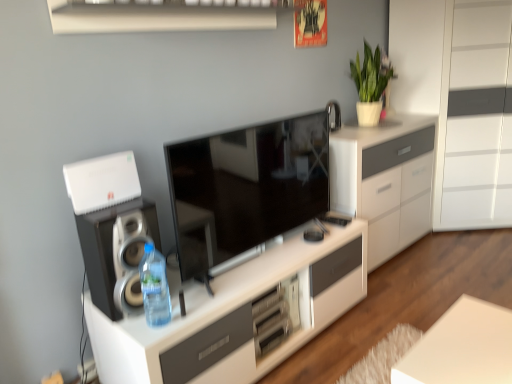
Question: Is white matte table at lower right inside white glossy cabinet at right?

Choices:
 (A) no
 (B) yes

Answer: (A)

Question: Is white matte table at lower right at the back of white glossy cabinet at right?

Choices:
 (A) yes
 (B) no

Answer: (B)

Question: Is white glossy cabinet at right bigger than white matte table at lower right?

Choices:
 (A) yes
 (B) no

Answer: (A)

Question: Can you confirm if white glossy cabinet at right is wider than white matte table at lower right?

Choices:
 (A) yes
 (B) no

Answer: (A)

Question: From a real-world perspective, is white glossy cabinet at right located higher than white matte table at lower right?

Choices:
 (A) no
 (B) yes

Answer: (B)

Question: Looking at the image, does white glossy cabinet at center, which appears as the first cabinetry when ordered from the bottom, seem bigger or smaller compared to white glossy cabinet at center, positioned as the 1th cabinetry in top-to-bottom order?

Choices:
 (A) small
 (B) big

Answer: (A)

Question: In the image, is white glossy cabinet at center, which appears as the first cabinetry when ordered from the bottom, on the left side or the right side of white glossy cabinet at center, placed as the second cabinetry when sorted from bottom to top?

Choices:
 (A) left
 (B) right

Answer: (A)

Question: Is white glossy cabinet at center, placed as the 2th cabinetry when sorted from top to bottom, situated inside white glossy cabinet at center, placed as the second cabinetry when sorted from bottom to top, or outside?

Choices:
 (A) inside
 (B) outside

Answer: (B)

Question: From a real-world perspective, is white glossy cabinet at center, which appears as the first cabinetry when ordered from the bottom, physically located above or below white glossy cabinet at center, positioned as the 1th cabinetry in top-to-bottom order?

Choices:
 (A) below
 (B) above

Answer: (A)

Question: In terms of height, does matte black speaker at left look taller or shorter compared to white plastic router at upper left?

Choices:
 (A) short
 (B) tall

Answer: (B)

Question: In the image, is matte black speaker at left on the left side or the right side of white plastic router at upper left?

Choices:
 (A) right
 (B) left

Answer: (A)

Question: From the image's perspective, relative to white plastic router at upper left, is matte black speaker at left above or below?

Choices:
 (A) above
 (B) below

Answer: (B)

Question: Based on their sizes in the image, would you say matte black speaker at left is bigger or smaller than white plastic router at upper left?

Choices:
 (A) big
 (B) small

Answer: (A)

Question: From a real-world perspective, is white glossy shelf at upper center physically located above or below white glossy cabinet at center, placed as the second cabinetry when sorted from bottom to top?

Choices:
 (A) below
 (B) above

Answer: (B)

Question: From their relative heights in the image, would you say white glossy shelf at upper center is taller or shorter than white glossy cabinet at center, positioned as the 1th cabinetry in top-to-bottom order?

Choices:
 (A) tall
 (B) short

Answer: (B)